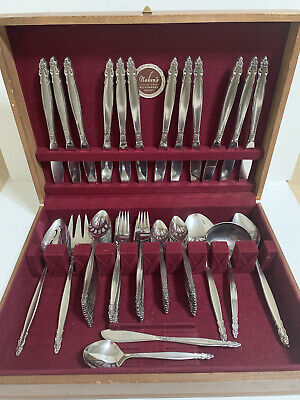
Locate an element on the screen. The width and height of the screenshot is (300, 400). serving spoons is located at coordinates (111, 356), (227, 236), (253, 225), (202, 226).